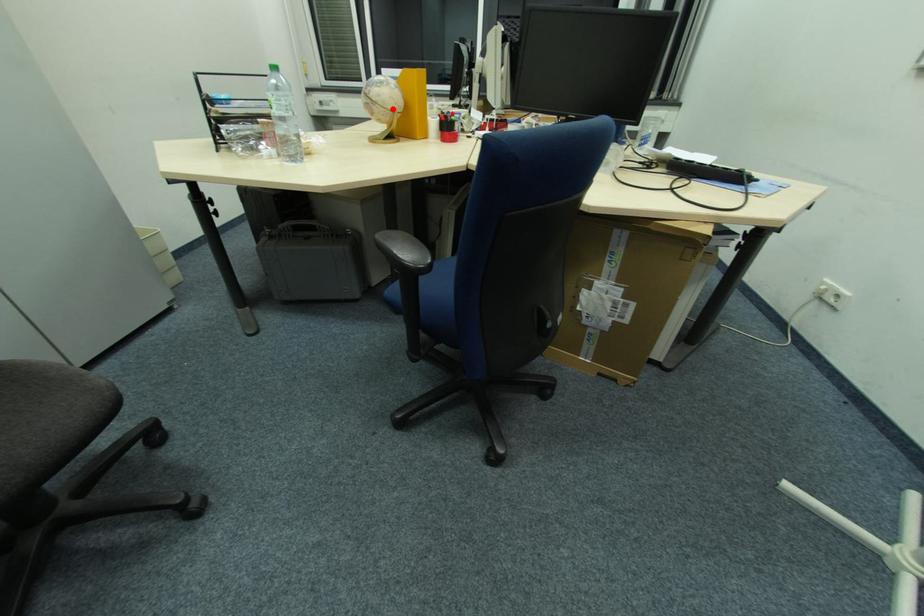
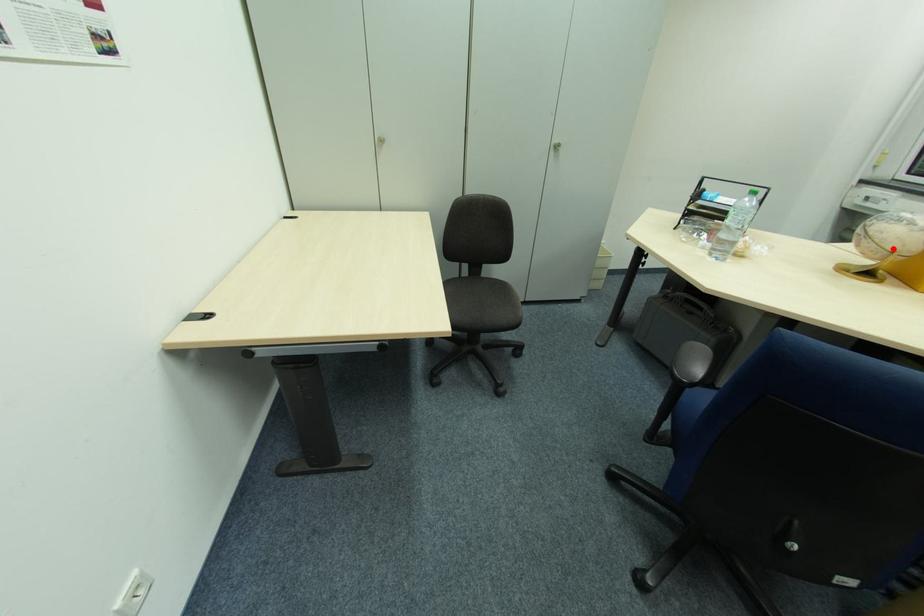
I am providing you with two images of the same scene from different viewpoints. A red point is marked on the first image and another point is marked on the second image. Is the marked point in image1 the same physical position as the marked point in image2?

Yes